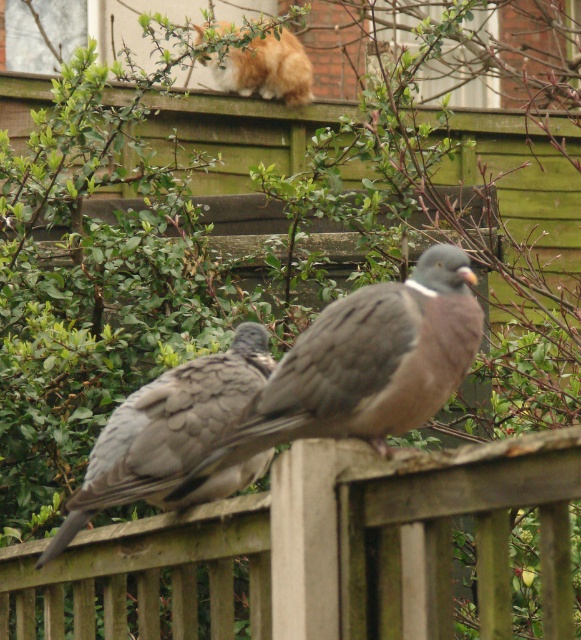
In the scene shown: You are a bird trying to land on the wooden fence at center. There is also an orange and white fur cat at upper center nearby. Based on their sizes, which one would be easier to avoid if you want to land safely?

The wooden fence at center has a larger size compared to orange and white fur cat at upper center, so the cat is smaller and easier to avoid when landing safely.

You are standing at the point labeled as point [327,547] in the image. Looking around, you see the wooden fence at center. Can you tell me what object is located exactly at your current position?

The point [327,547] corresponds to the wooden fence at center.

You are a photographer trying to capture a photo of the orange and white fur cat at upper center and the wooden fence at center. From the photographer perspective, which object is positioned to the right side of the other?

The wooden fence at center is to the right of the orange and white fur cat at upper center according to the description.